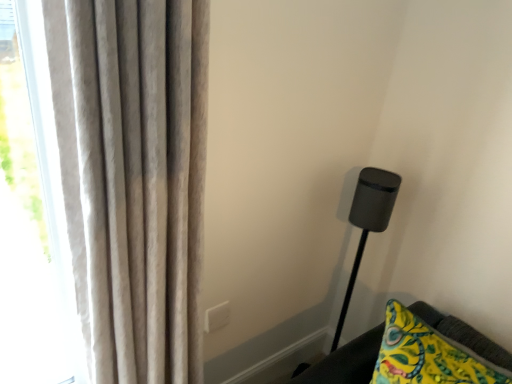
Question: Should I look upward or downward to see satin beige curtains at left?

Choices:
 (A) down
 (B) up

Answer: (A)